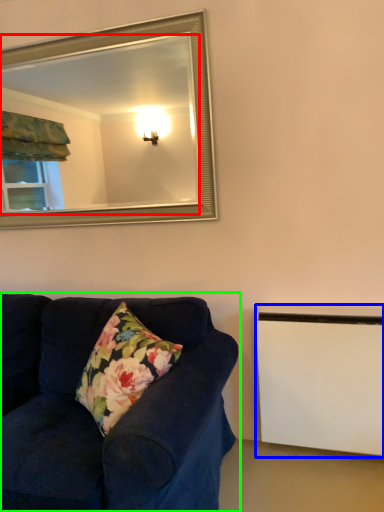
Question: Which object is the closest to the mirror (highlighted by a red box)? Choose among these: radiator (highlighted by a blue box) or studio couch (highlighted by a green box).

Choices:
 (A) radiator
 (B) studio couch

Answer: (B)